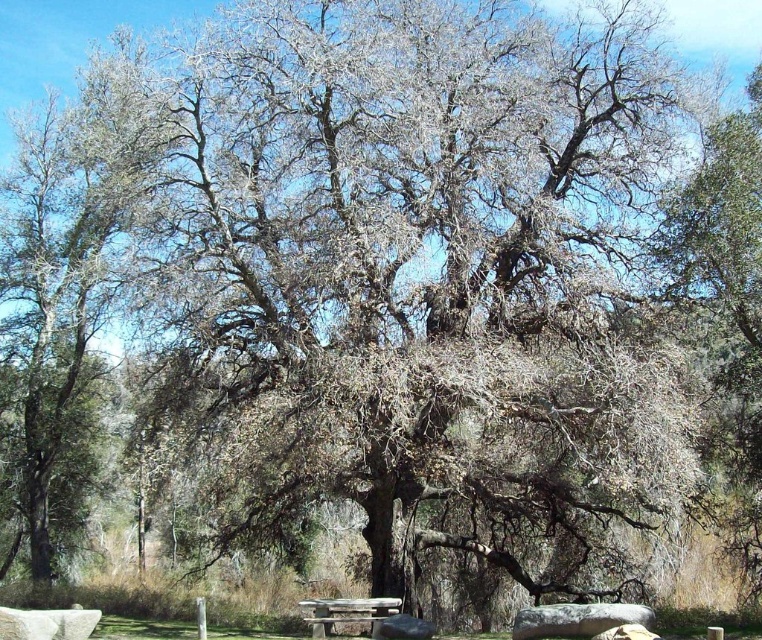
Does grayish-brown bark tree at center come in front of wooden picnic table at center?

No, it is behind wooden picnic table at center.

Can you confirm if grayish-brown bark tree at center is taller than wooden picnic table at center?

Yes.

Which is in front, point (91, 208) or point (370, 636)?

Point (370, 636) is more forward.

This screenshot has width=762, height=640. Identify the location of grayish-brown bark tree at center. (66, 285).